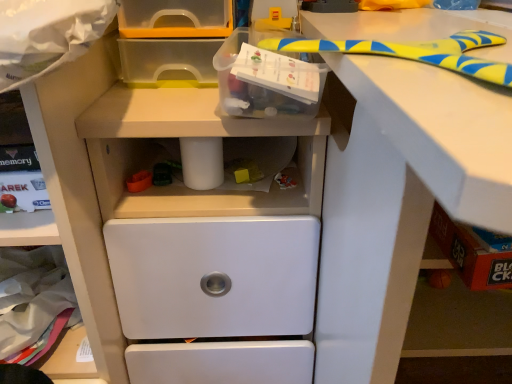
Question: Can you confirm if translucent plastic box at upper center is bigger than white plastic drawer at lower center?

Choices:
 (A) yes
 (B) no

Answer: (B)

Question: Is translucent plastic box at upper center closer to the viewer compared to white plastic drawer at lower center?

Choices:
 (A) yes
 (B) no

Answer: (A)

Question: Is translucent plastic box at upper center to the right of white plastic drawer at lower center from the viewer's perspective?

Choices:
 (A) no
 (B) yes

Answer: (B)

Question: Is translucent plastic box at upper center shorter than white plastic drawer at lower center?

Choices:
 (A) no
 (B) yes

Answer: (B)

Question: Is translucent plastic box at upper center far from white plastic drawer at lower center?

Choices:
 (A) no
 (B) yes

Answer: (A)

Question: Can white plastic drawer at lower center be found inside translucent plastic box at upper center?

Choices:
 (A) no
 (B) yes

Answer: (A)

Question: Is white plastic drawer at lower center to the right of translucent plastic box at upper center from the viewer's perspective?

Choices:
 (A) yes
 (B) no

Answer: (B)

Question: Does white plastic drawer at lower center have a greater height compared to translucent plastic box at upper center?

Choices:
 (A) yes
 (B) no

Answer: (A)

Question: Would you say white plastic drawer at lower center is a long distance from translucent plastic box at upper center?

Choices:
 (A) no
 (B) yes

Answer: (A)

Question: From the image's perspective, is white plastic drawer at lower center beneath translucent plastic box at upper center?

Choices:
 (A) yes
 (B) no

Answer: (A)

Question: Is white plastic drawer at lower center aimed at translucent plastic box at upper center?

Choices:
 (A) no
 (B) yes

Answer: (A)

Question: Is white plastic drawer at lower center turned away from translucent plastic box at upper center?

Choices:
 (A) no
 (B) yes

Answer: (A)

Question: Can you confirm if translucent plastic box at upper center is taller than white plastic workbench at center?

Choices:
 (A) yes
 (B) no

Answer: (B)